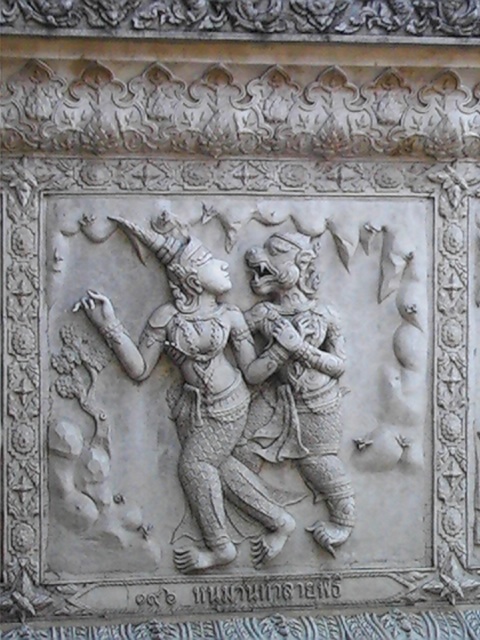
Is white stone deity at center bigger than white stone demon at center?

Yes, white stone deity at center is bigger than white stone demon at center.

Does white stone deity at center have a greater height compared to white stone demon at center?

Indeed, white stone deity at center has a greater height compared to white stone demon at center.

Identify the location of white stone deity at center. (201, 387).